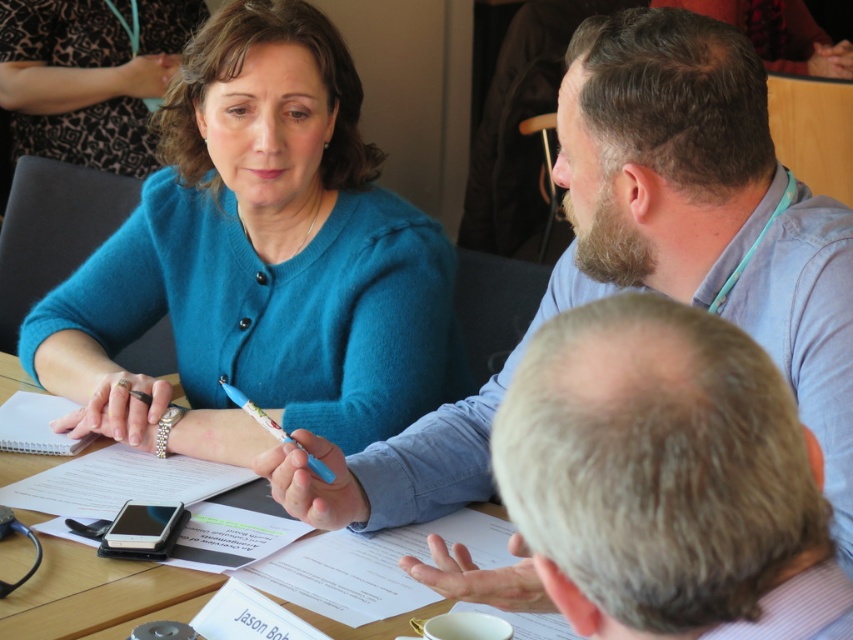
Which is below, blue fabric shirt at upper center or wooden table at center?

wooden table at center

Consider the image. Does blue fabric shirt at upper center have a lesser height compared to wooden table at center?

Incorrect, blue fabric shirt at upper center's height does not fall short of wooden table at center's.

The image size is (853, 640). Identify the location of blue fabric shirt at upper center. (704, 209).

Locate an element on the screen. blue fabric shirt at upper center is located at coordinates (704, 209).

Is blue fabric shirt at upper center closer to the viewer compared to white paper notepad at upper left?

Yes, blue fabric shirt at upper center is closer to the viewer.

The height and width of the screenshot is (640, 853). What do you see at coordinates (704, 209) in the screenshot?
I see `blue fabric shirt at upper center` at bounding box center [704, 209].

Locate an element on the screen. This screenshot has width=853, height=640. blue fabric shirt at upper center is located at coordinates (704, 209).

Can you confirm if teal fuzzy sweater at upper left is positioned below blue plastic pen at center?

No, teal fuzzy sweater at upper left is not below blue plastic pen at center.

Which of these two, teal fuzzy sweater at upper left or blue plastic pen at center, stands taller?

With more height is teal fuzzy sweater at upper left.

Locate an element on the screen. This screenshot has height=640, width=853. teal fuzzy sweater at upper left is located at coordinates (258, 260).

Locate an element on the screen. The width and height of the screenshot is (853, 640). teal fuzzy sweater at upper left is located at coordinates (258, 260).